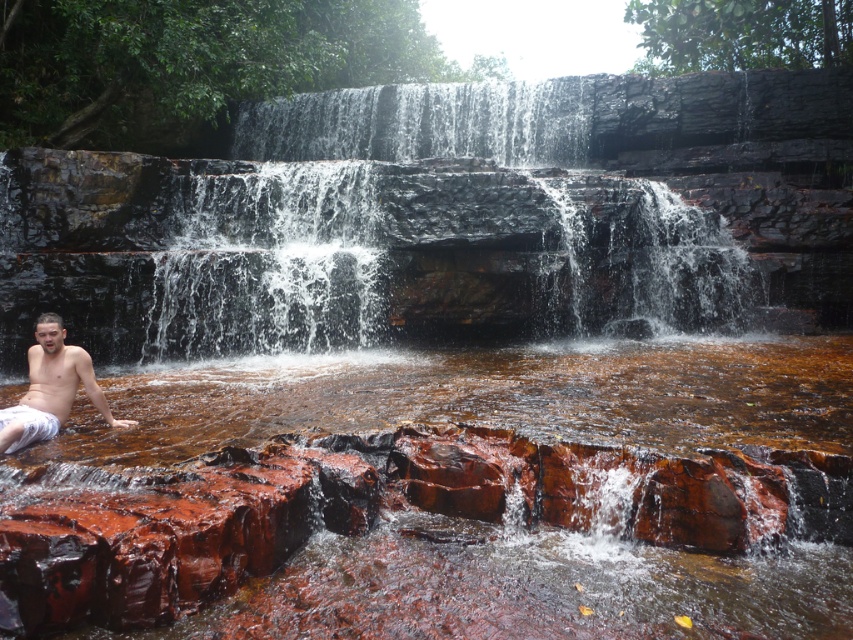
You are standing at the base of the waterfall and want to reach a specific point marked at coordinates point (711,328). Given that the distance from your current position to this point is 43.54 feet, can you estimate whether this point is within a safe walking distance for an average adult?

The point (711,328) is 43.54 feet away from your current position. An average adult can comfortably walk this distance, so it is within a safe walking range.

You are standing at the edge of the waterfall and want to take a photo of the brown glossy water at center. According to the coordinates provided, where should you aim your camera to capture it?

You should aim your camera at point 0.628 on the x axis and 0.542 on the y axis to capture the brown glossy water at center.

You are a photographer planning to capture the waterfall scene. You notice the brown glossy water at center and the shiny white shorts at lower left. Based on their sizes in the image, which object appears larger in the frame?

The brown glossy water at center appears larger in the frame because it is much taller than the shiny white shorts at lower left.